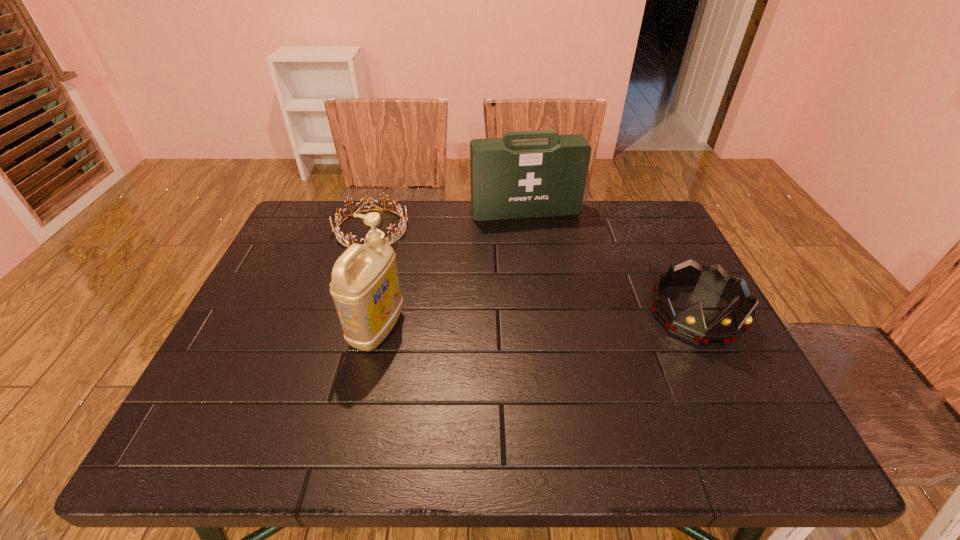
Locate an element on the screen. The height and width of the screenshot is (540, 960). free space on the desktop that is between the detergent and the taller tiara and is positioned on the front-facing side of the first-aid kit is located at coordinates (562, 320).

You are a GUI agent. You are given a task and a screenshot of the screen. Output one action in this format:
    pyautogui.click(x=<x>, y=<y>)
    Task: Click on the free spot on the desktop that is between the detergent and the second shortest object and is positioned on the front-facing side of the shortest object
    The width and height of the screenshot is (960, 540).
    Given the screenshot: What is the action you would take?
    pyautogui.click(x=503, y=323)